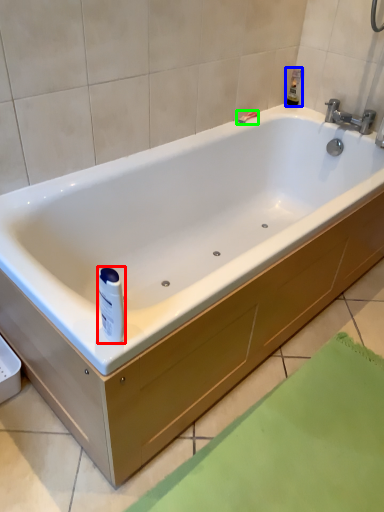
Question: Considering the real-world distances, which object is closest to toiletry (highlighted by a red box)? toiletry (highlighted by a blue box) or shower (highlighted by a green box).

Choices:
 (A) toiletry
 (B) shower

Answer: (B)